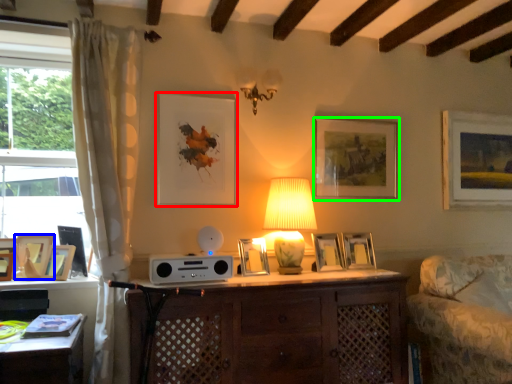
Question: Which object is positioned farthest from picture frame (highlighted by a red box)? Select from picture frame (highlighted by a blue box) and picture frame (highlighted by a green box).

Choices:
 (A) picture frame
 (B) picture frame

Answer: (A)